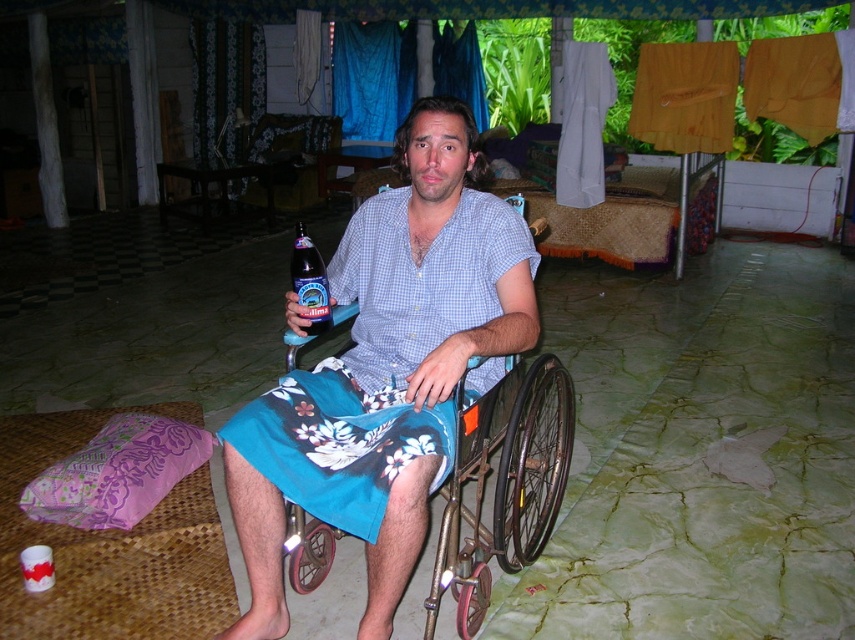
Which is behind, point (407, 353) or point (376, 284)?

Positioned behind is point (376, 284).

From the picture: Is blue floral shorts at center taller than blue checkered shirt at center?

Yes, blue floral shorts at center is taller than blue checkered shirt at center.

Describe the element at coordinates (385, 372) in the screenshot. I see `blue floral shorts at center` at that location.

Locate an element on the screen. blue floral shorts at center is located at coordinates (385, 372).

Which of these two, metallic silver wheelchair at center or dark blue glass bottle at center, stands shorter?

Standing shorter between the two is dark blue glass bottle at center.

Is point (485, 611) positioned before point (292, 275)?

No, (485, 611) is further to viewer.

Where is `metallic silver wheelchair at center`? This screenshot has height=640, width=855. metallic silver wheelchair at center is located at coordinates (502, 483).

Between blue floral shorts at center and dark blue glass bottle at center, which one has more height?

blue floral shorts at center

Describe the element at coordinates (385, 372) in the screenshot. I see `blue floral shorts at center` at that location.

Does point (426, 422) lie behind point (293, 244)?

No, it is not.

At what (x,y) coordinates should I click in order to perform the action: click on blue floral shorts at center. Please return your answer as a coordinate pair (x, y). Looking at the image, I should click on (385, 372).